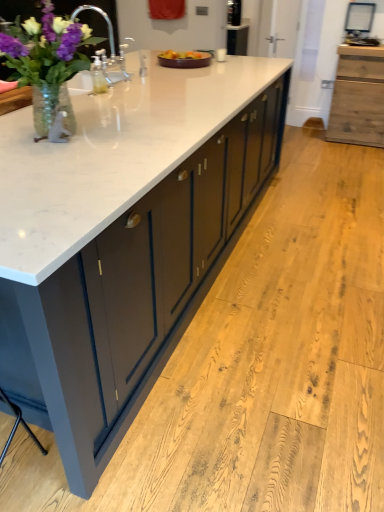
Where is `empty space that is ontop of white marble countertop at center (from a real-world perspective)`? Image resolution: width=384 pixels, height=512 pixels. empty space that is ontop of white marble countertop at center (from a real-world perspective) is located at coordinates (132, 98).